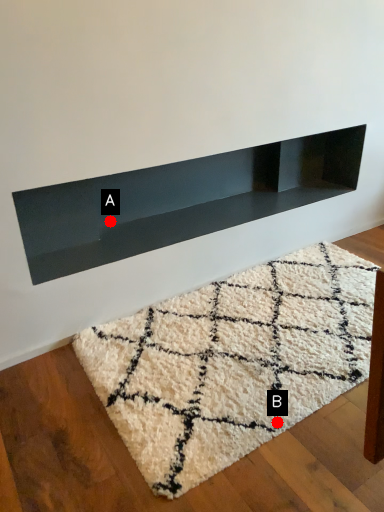
Question: Two points are circled on the image, labeled by A and B beside each circle. Which point is closer to the camera taking this photo?

Choices:
 (A) A is closer
 (B) B is closer

Answer: (B)